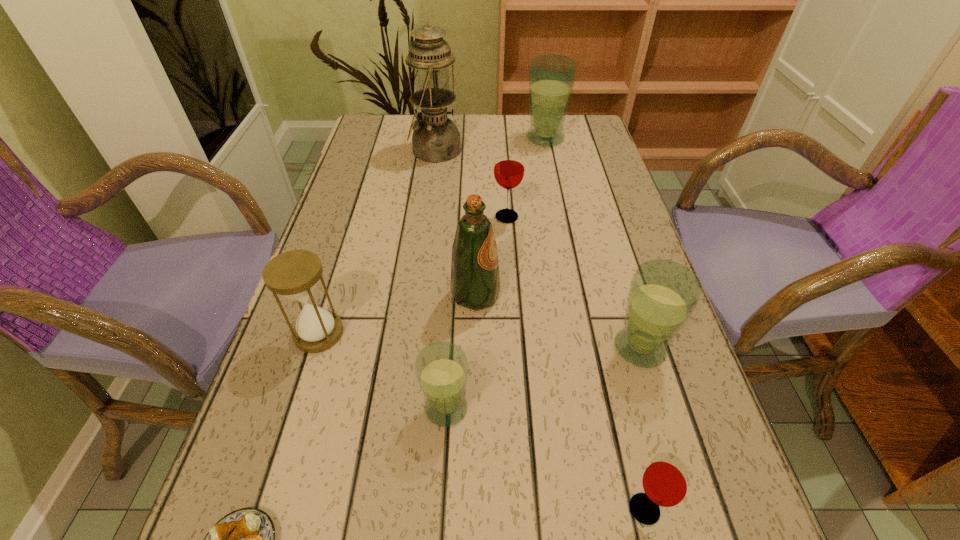
Image resolution: width=960 pixels, height=540 pixels. In order to click on the tallest object in this screenshot , I will do `click(436, 138)`.

Locate an element on the screen. Image resolution: width=960 pixels, height=540 pixels. olive oil is located at coordinates [475, 282].

This screenshot has width=960, height=540. I want to click on green olive oil, so pyautogui.click(x=475, y=282).

In order to click on the tallest glass in this screenshot , I will do `click(551, 77)`.

The image size is (960, 540). Identify the location of the farthest glass. point(551,77).

Find the location of `the bigger red glass`. the bigger red glass is located at coordinates [509, 167].

This screenshot has height=540, width=960. I want to click on the left red glass, so click(509, 167).

This screenshot has width=960, height=540. Find the location of `the third farthest glass`. the third farthest glass is located at coordinates (663, 294).

Identify the location of the second smallest blue glass. (663, 294).

You are a GUI agent. You are given a task and a screenshot of the screen. Output one action in this format:
    pyautogui.click(x=<x>, y=<y>)
    Task: Click on the hourglass
    
    Given the screenshot: What is the action you would take?
    pyautogui.click(x=294, y=274)